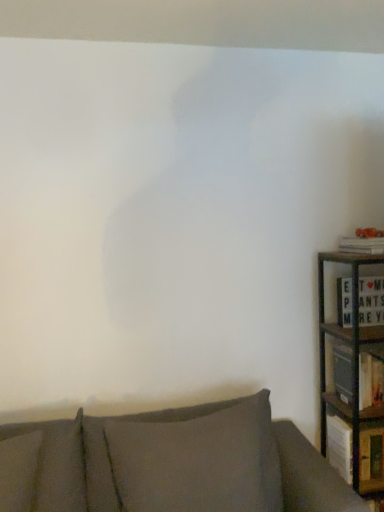
Question: In the image, is wooden bookshelf at right positioned in front of or behind orange textured book at right, the third book from the bottom?

Choices:
 (A) front
 (B) behind

Answer: (B)

Question: Is wooden bookshelf at right spatially inside orange textured book at right, which is the 1th book from top to bottom, or outside of it?

Choices:
 (A) inside
 (B) outside

Answer: (B)

Question: Estimate the real-world distances between objects in this image. Which object is farther from the metallic green bookcase at right?

Choices:
 (A) textured gray couch at lower center
 (B) wooden bookshelf at right
 (C) white matte letter board at right, the 2th book from the top
 (D) wooden book at right, placed as the 1th book when sorted from bottom to top
 (E) orange textured book at right, which is the 1th book from top to bottom

Answer: (A)

Question: Which object is positioned farthest from the wooden bookshelf at right?

Choices:
 (A) dark gray fabric pillow at lower center
 (B) metallic green bookcase at right
 (C) wooden book at right, positioned as the 3th book in top-to-bottom order
 (D) white matte letter board at right, the 2th book from the top
 (E) textured gray couch at lower center

Answer: (E)